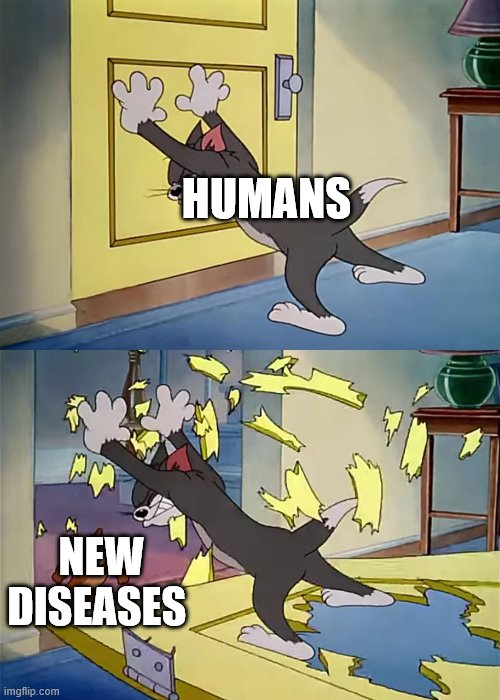
Where is `hinge`? This screenshot has height=700, width=500. hinge is located at coordinates (145, 668).